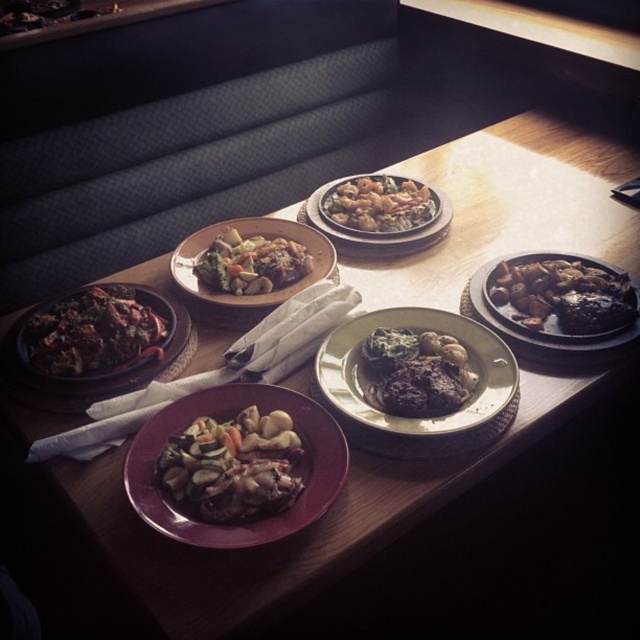
You are sitting at the dining table and want to reach for the shiny dark brown meat at right and the shiny brown meat at center. Which one is closer to your right hand?

The shiny dark brown meat at right is more on the right side, so it is closer to your right hand.

You are a food critic sitting at the table. You want to describe the spatial arrangement of the shiny brown mushrooms at center and the dark brown glossy meat at left. Which object is positioned lower on the table?

The shiny brown mushrooms at center is located below dark brown glossy meat at left, so the shiny brown mushrooms at center is positioned lower on the table.

From the picture: You are a chef inspecting the dining setup. You need to determine which item is shorter between the shiny brown mushrooms at center and the dark brown glossy meat at left. Which one is shorter?

The shiny brown mushrooms at center are shorter than the dark brown glossy meat at left according to the description.